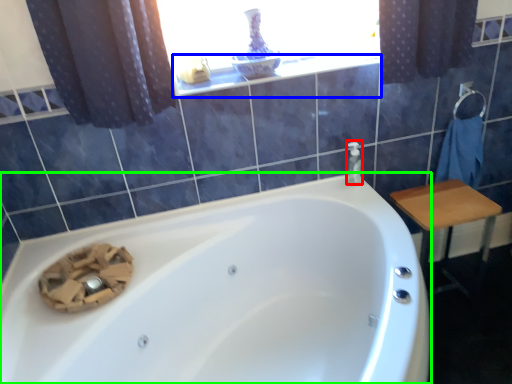
Question: Estimate the real-world distances between objects in this image. Which object is farther from soap dispenser (highlighted by a red box), window sill (highlighted by a blue box) or bathtub (highlighted by a green box)?

Choices:
 (A) window sill
 (B) bathtub

Answer: (B)